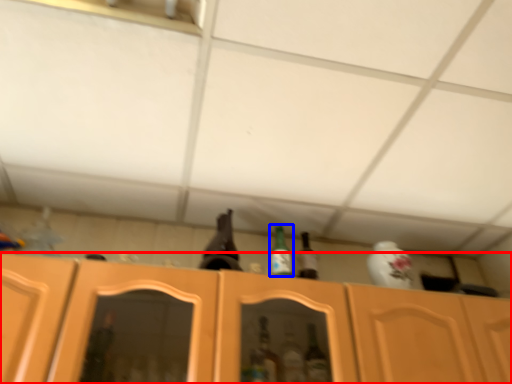
Question: Among these objects, which one is nearest to the camera, cabinetry (highlighted by a red box) or bottle (highlighted by a blue box)?

Choices:
 (A) cabinetry
 (B) bottle

Answer: (A)